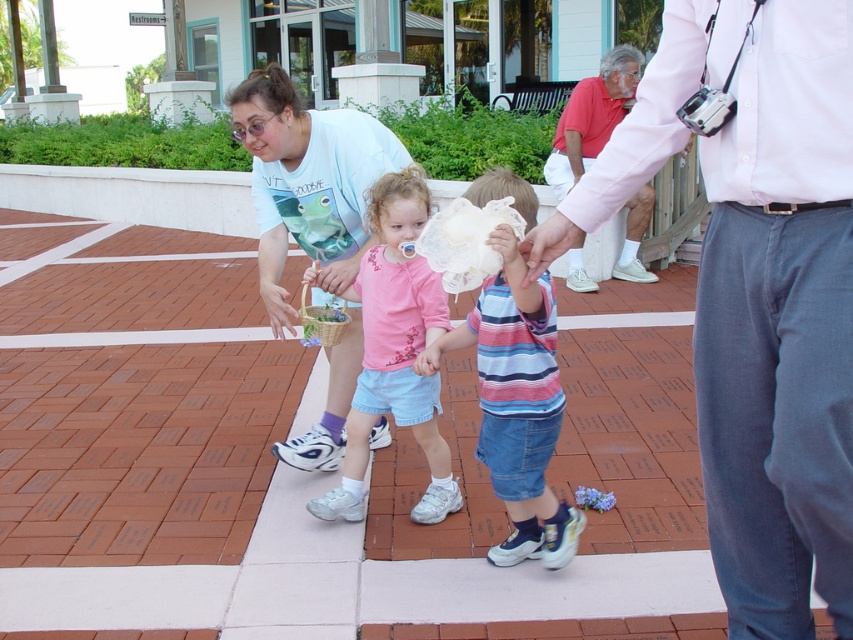
Question: Does striped cotton shirt at center appear over pink fabric shirt at center?

Choices:
 (A) no
 (B) yes

Answer: (A)

Question: Which of the following is the closest to the observer?

Choices:
 (A) matte pink shirt at upper right
 (B) light blue t-shirt at center
 (C) pink fabric shirt at center

Answer: (A)

Question: Is pink fabric shirt at center below red cotton shirt at upper right?

Choices:
 (A) no
 (B) yes

Answer: (B)

Question: Among these points, which one is nearest to the camera?

Choices:
 (A) (515, 445)
 (B) (730, 458)
 (C) (643, 198)
 (D) (392, 346)

Answer: (B)

Question: Considering the real-world distances, which object is closest to the red cotton shirt at upper right?

Choices:
 (A) matte pink shirt at upper right
 (B) light blue t-shirt at center

Answer: (B)

Question: Observing the image, what is the correct spatial positioning of striped cotton shirt at center in reference to red cotton shirt at upper right?

Choices:
 (A) right
 (B) left

Answer: (B)